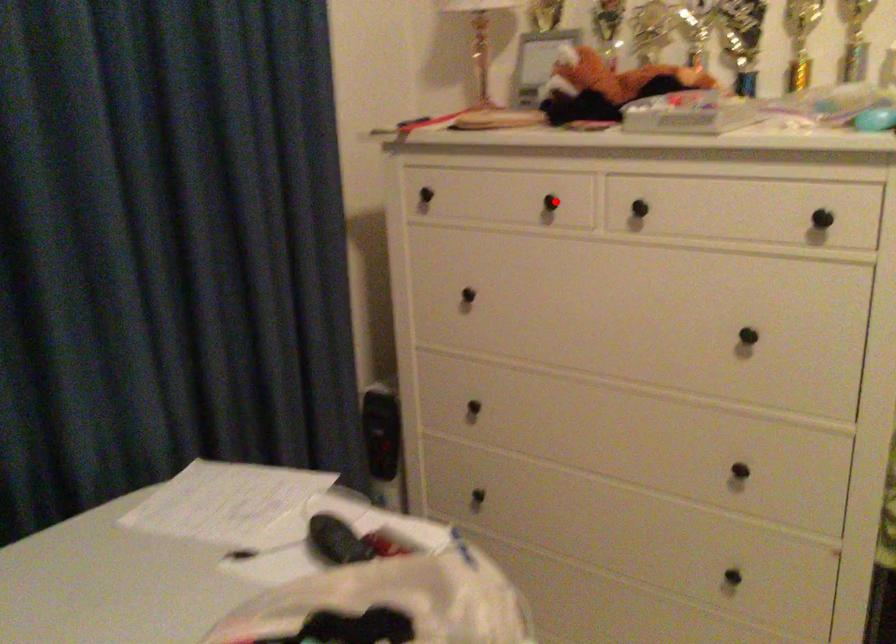
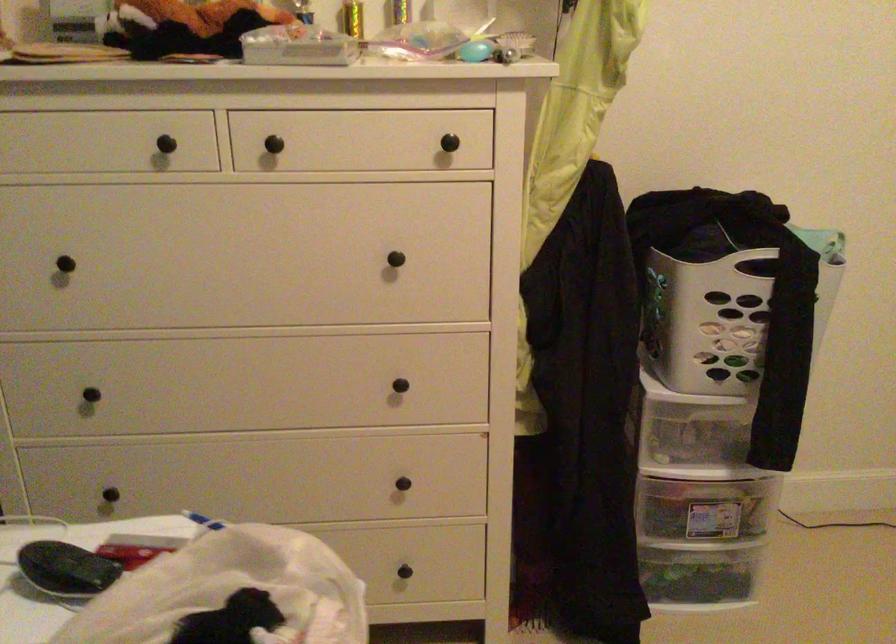
Question: I am providing you with two images of the same scene from different viewpoints. In image1, a red point is highlighted. Considering the same 3D point in image2, which of the following is correct?

Choices:
 (A) It is closer
 (B) It is farther

Answer: (A)